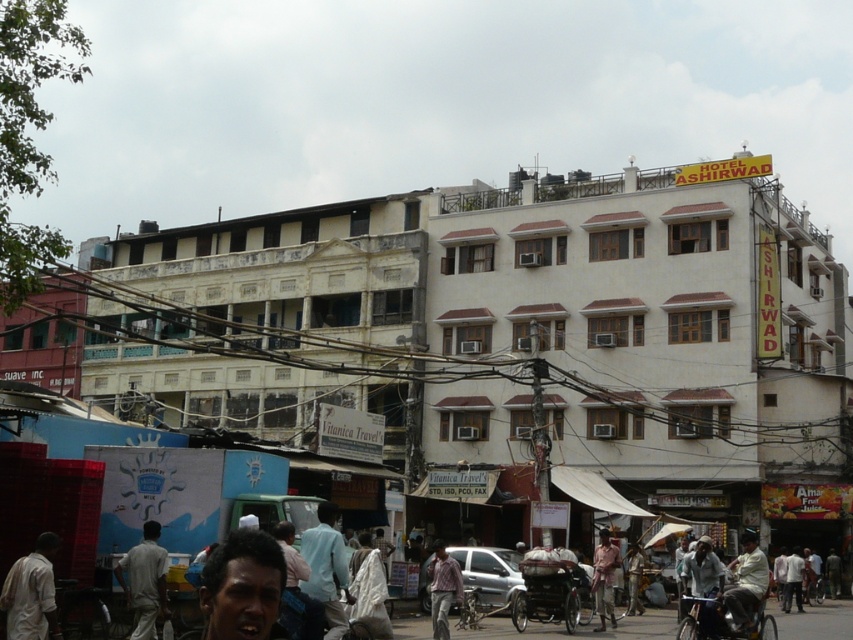
Which of these two, white cloth at lower left or light brown fabric shirt at lower center, stands taller?

light brown fabric shirt at lower center is taller.

Based on the photo, does white cloth at lower left have a greater width compared to light brown fabric shirt at lower center?

Yes.

Where is `white cloth at lower left`? The image size is (853, 640). white cloth at lower left is located at coordinates (32, 593).

Measure the distance between point (624, 449) and camera.

Point (624, 449) and camera are 84.94 meters apart from each other.

Does black wire at upper center appear under light beige fabric shirt at center?

No.

Who is more distant from viewer, (671, 472) or (741, 588)?

The point (671, 472) is behind.

Image resolution: width=853 pixels, height=640 pixels. What are the coordinates of `black wire at upper center` in the screenshot? It's located at (480, 337).

Does light blue shirt at center have a lesser width compared to light blue fabric shirt at center?

Correct, light blue shirt at center's width is less than light blue fabric shirt at center's.

Does light blue shirt at center appear on the right side of light blue fabric shirt at center?

In fact, light blue shirt at center is to the left of light blue fabric shirt at center.

The width and height of the screenshot is (853, 640). What are the coordinates of `light blue shirt at center` in the screenshot? It's located at point(326,568).